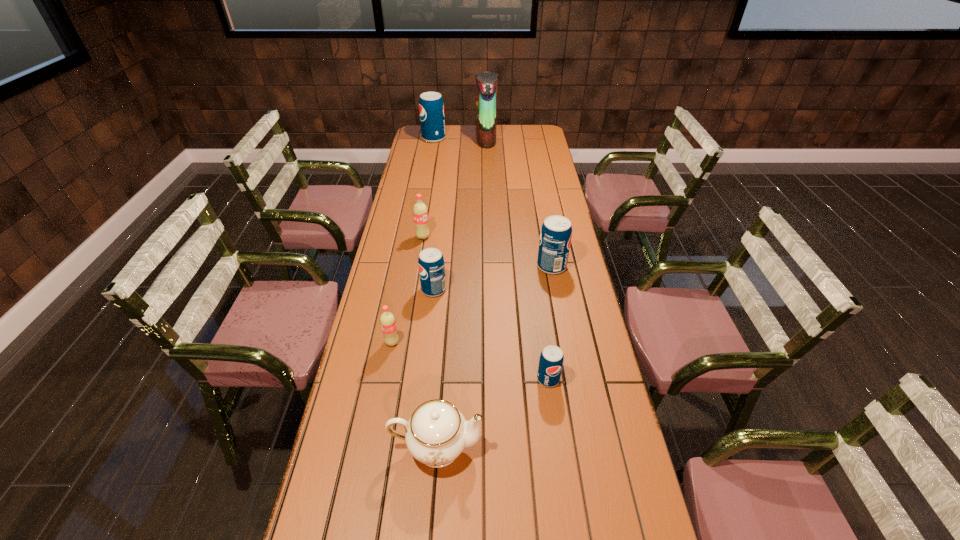
The height and width of the screenshot is (540, 960). I want to click on parrot, so click(x=486, y=94).

Identify the location of the farthest blue pop. (431, 107).

At what (x,y) coordinates should I click in order to perform the action: click on the farthest pop. Please return your answer as a coordinate pair (x, y). This screenshot has height=540, width=960. Looking at the image, I should click on (431, 107).

Where is `the fourth nearest pop`? Image resolution: width=960 pixels, height=540 pixels. the fourth nearest pop is located at coordinates coord(556,232).

The image size is (960, 540). I want to click on the fifth nearest object, so click(556, 232).

Locate an element on the screen. Image resolution: width=960 pixels, height=540 pixels. the third farthest object is located at coordinates (420, 212).

Identify the location of the bigger red soda. (420, 212).

In order to click on the fourth farthest pop in this screenshot , I will do `click(431, 265)`.

Where is `the fourth nearest object`? the fourth nearest object is located at coordinates (431, 265).

Where is `the smaller red soda`? This screenshot has width=960, height=540. the smaller red soda is located at coordinates (387, 320).